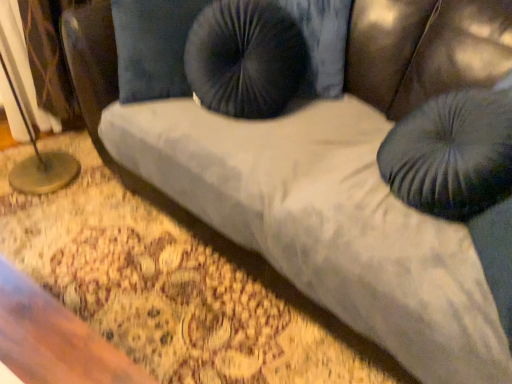
Question: Is velvet dark blue bean bag at upper center far from suede-like black pillow at center?

Choices:
 (A) yes
 (B) no

Answer: (B)

Question: From a real-world perspective, is velvet dark blue bean bag at upper center located beneath suede-like black pillow at center?

Choices:
 (A) no
 (B) yes

Answer: (A)

Question: From the image's perspective, is velvet dark blue bean bag at upper center located beneath suede-like black pillow at center?

Choices:
 (A) no
 (B) yes

Answer: (B)

Question: Is velvet dark blue bean bag at upper center next to suede-like black pillow at center and touching it?

Choices:
 (A) no
 (B) yes

Answer: (A)

Question: Is velvet dark blue bean bag at upper center smaller than suede-like black pillow at center?

Choices:
 (A) yes
 (B) no

Answer: (A)

Question: From a real-world perspective, is velvet dark blue bean bag at upper center physically above suede-like black pillow at center?

Choices:
 (A) no
 (B) yes

Answer: (B)

Question: Can you confirm if suede-like black pillow at center is taller than metallic gold table lamp at left?

Choices:
 (A) yes
 (B) no

Answer: (B)

Question: Is suede-like black pillow at center thinner than metallic gold table lamp at left?

Choices:
 (A) yes
 (B) no

Answer: (A)

Question: Can you confirm if suede-like black pillow at center is positioned to the left of metallic gold table lamp at left?

Choices:
 (A) yes
 (B) no

Answer: (B)

Question: Considering the relative sizes of suede-like black pillow at center and metallic gold table lamp at left in the image provided, is suede-like black pillow at center bigger than metallic gold table lamp at left?

Choices:
 (A) no
 (B) yes

Answer: (A)

Question: Does suede-like black pillow at center appear on the right side of metallic gold table lamp at left?

Choices:
 (A) no
 (B) yes

Answer: (B)

Question: From a real-world perspective, does suede-like black pillow at center sit lower than metallic gold table lamp at left?

Choices:
 (A) yes
 (B) no

Answer: (B)

Question: Could you tell me if velvet dark blue bean bag at upper center is facing metallic gold table lamp at left?

Choices:
 (A) yes
 (B) no

Answer: (B)